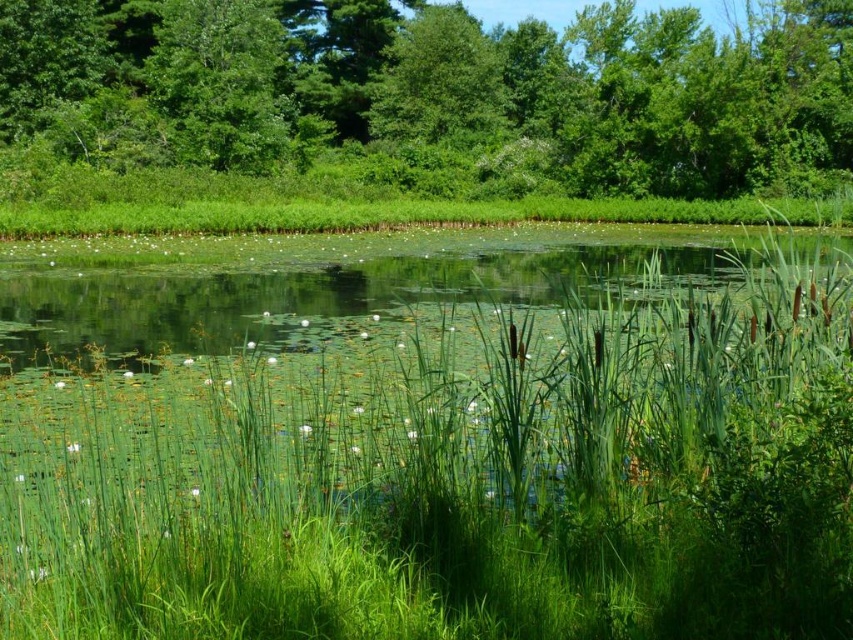
You are standing at the edge of the pond and want to place a small decorative stone exactly at the center of the green grass at center. According to the coordinates provided, where should you place the stone?

The green grass at center is located at coordinates point (434,440), so you should place the stone there.

You are a gardener who wants to plant a new flower bed. You have two areas to choose from in the scene described. One is the green grass at center and the other is the green leafy tree at upper center. Which area has more space available for planting?

The green leafy tree at upper center has more space available for planting since it occupies more space than the green grass at center according to the description.